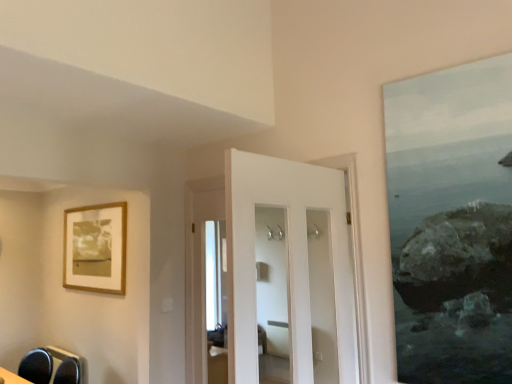
What is the approximate height of wooden frame at upper left?

78.85 centimeters.

Locate an element on the screen. The width and height of the screenshot is (512, 384). wooden frame at upper left is located at coordinates (95, 248).

Is wooden frame at upper left to the right of matte black swivel chair at lower left from the viewer's perspective?

Indeed, wooden frame at upper left is positioned on the right side of matte black swivel chair at lower left.

From the image's perspective, does wooden frame at upper left appear lower than matte black swivel chair at lower left?

No, from the image's perspective, wooden frame at upper left is not below matte black swivel chair at lower left.

From a real-world perspective, which is physically above, wooden frame at upper left or matte black swivel chair at lower left?

From a 3D spatial view, wooden frame at upper left is above.

From a real-world perspective, is wooden frame at upper left on white glossy door at center?

Indeed, from a real-world perspective, wooden frame at upper left stands above white glossy door at center.

Where is `picture frame above the white glossy door at center (from a real-world perspective)`? Image resolution: width=512 pixels, height=384 pixels. picture frame above the white glossy door at center (from a real-world perspective) is located at coordinates (95, 248).

Is point (86, 241) in front of point (248, 313)?

No.

Is wooden frame at upper left aimed at white glossy door at center?

No, wooden frame at upper left is not aimed at white glossy door at center.

From the picture: Which object is closer to the camera, matte black swivel chair at lower left or wooden frame at upper left?

matte black swivel chair at lower left is more forward.

Is matte black swivel chair at lower left looking in the opposite direction of wooden frame at upper left?

No, matte black swivel chair at lower left's orientation is not away from wooden frame at upper left.

From a real-world perspective, is matte black swivel chair at lower left located higher than wooden frame at upper left?

No.

Consider the image. Which object is positioned more to the left, matte black swivel chair at lower left or wooden frame at upper left?

Positioned to the left is matte black swivel chair at lower left.

Does white glossy door at center have a smaller size compared to wooden frame at upper left?

No.

Is white glossy door at center positioned with its back to wooden frame at upper left?

No, white glossy door at center is not facing away from wooden frame at upper left.

Which point is more distant from viewer, (30, 359) or (234, 331)?

The point (30, 359) is farther.

Can you confirm if matte black swivel chair at lower left is positioned to the right of white glossy door at center?

Incorrect, matte black swivel chair at lower left is not on the right side of white glossy door at center.

The image size is (512, 384). I want to click on swivel chair that appears below the white glossy door at center (from the image's perspective), so click(36, 366).

Is matte black swivel chair at lower left positioned in front of white glossy door at center?

→ No, matte black swivel chair at lower left is further to the viewer.

From the image's perspective, which is below, white glossy door at center or matte black swivel chair at lower left?

matte black swivel chair at lower left appears lower in the image.

Considering the sizes of objects white glossy door at center and matte black swivel chair at lower left in the image provided, who is shorter, white glossy door at center or matte black swivel chair at lower left?

Standing shorter between the two is matte black swivel chair at lower left.

Can you confirm if white glossy door at center is smaller than matte black swivel chair at lower left?

Actually, white glossy door at center might be larger than matte black swivel chair at lower left.

What's the angular difference between white glossy door at center and matte black swivel chair at lower left's facing directions?

white glossy door at center and matte black swivel chair at lower left are facing 12.7 degrees away from each other.

Image resolution: width=512 pixels, height=384 pixels. I want to click on picture frame to the right of matte black swivel chair at lower left, so 95,248.

This screenshot has height=384, width=512. Identify the location of picture frame above the white glossy door at center (from the image's perspective). (95, 248).

Based on their spatial positions, is white glossy door at center or wooden frame at upper left further from matte black swivel chair at lower left?

white glossy door at center is positioned further to the anchor matte black swivel chair at lower left.

Which object lies nearer to the anchor point white glossy door at center, matte black swivel chair at lower left or wooden frame at upper left?

Based on the image, wooden frame at upper left appears to be nearer to white glossy door at center.

Based on their spatial positions, is matte black swivel chair at lower left or white glossy door at center further from wooden frame at upper left?

white glossy door at center is positioned further to the anchor wooden frame at upper left.

Looking at the image, which one is located further to wooden frame at upper left, white glossy door at center or matte black swivel chair at lower left?

white glossy door at center is further to wooden frame at upper left.

When comparing their distances from matte black swivel chair at lower left, does wooden frame at upper left or white glossy door at center seem further?

Based on the image, white glossy door at center appears to be further to matte black swivel chair at lower left.

Estimate the real-world distances between objects in this image. Which object is further from white glossy door at center, wooden frame at upper left or matte black swivel chair at lower left?

matte black swivel chair at lower left lies further to white glossy door at center than the other object.

In order to click on picture frame between matte black swivel chair at lower left and white glossy door at center from left to right in this screenshot , I will do `click(95, 248)`.